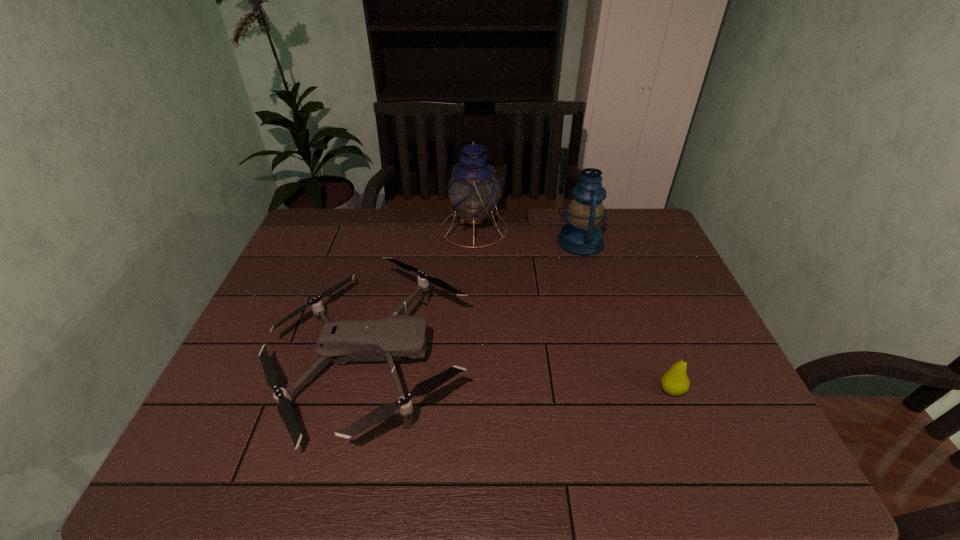
Identify the location of free location located on the left of the pear. [x=526, y=390].

Where is `blank space located 0.190m on the front-facing side of the drone`? The height and width of the screenshot is (540, 960). blank space located 0.190m on the front-facing side of the drone is located at coordinates (545, 359).

At what (x,y) coordinates should I click in order to perform the action: click on object that is at the near edge. Please return your answer as a coordinate pair (x, y). This screenshot has height=540, width=960. Looking at the image, I should click on (389, 339).

Identify the location of object positioned at the left edge. (389, 339).

Locate an element on the screen. Image resolution: width=960 pixels, height=540 pixels. object at the right edge is located at coordinates (674, 382).

This screenshot has height=540, width=960. Find the location of `object that is at the near left corner`. object that is at the near left corner is located at coordinates (389, 339).

Locate an element on the screen. Image resolution: width=960 pixels, height=540 pixels. free space at the far edge is located at coordinates (377, 230).

Identify the location of vacant point at the left edge. (276, 367).

Locate an element on the screen. free space at the right edge is located at coordinates (663, 275).

The height and width of the screenshot is (540, 960). Find the location of `blank area at the far right corner`. blank area at the far right corner is located at coordinates (648, 236).